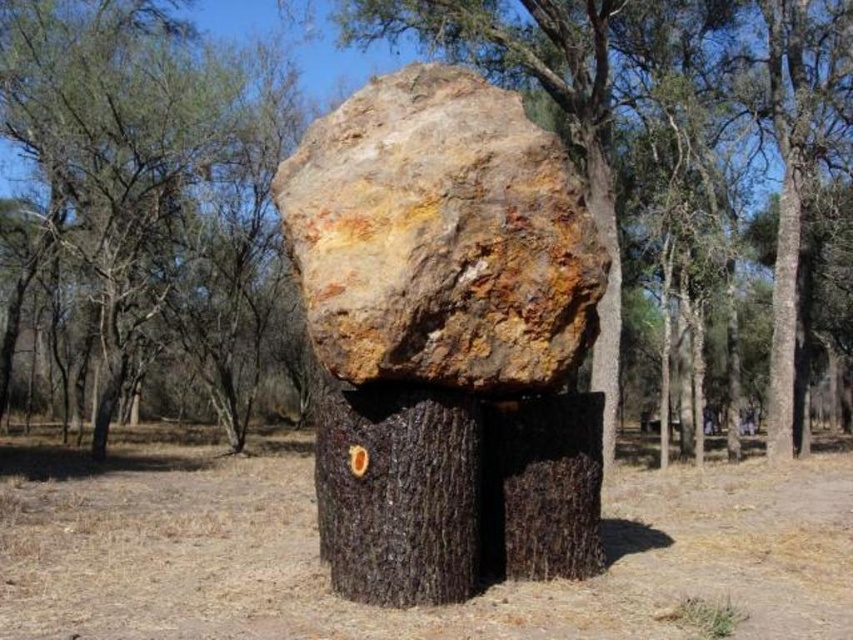
Question: Among these objects, which one is nearest to the camera?

Choices:
 (A) brown rough bark at center
 (B) rusty stone boulder at center
 (C) brown rough tree trunk at right
 (D) brown rough tree trunk at center

Answer: (B)

Question: Does brown rough bark at center come behind rusty stone boulder at center?

Choices:
 (A) yes
 (B) no

Answer: (A)

Question: Does brown rough bark at center have a greater width compared to brown rough tree trunk at right?

Choices:
 (A) yes
 (B) no

Answer: (A)

Question: Which of the following is the farthest from the observer?

Choices:
 (A) rusty stone boulder at center
 (B) brown rough tree trunk at center
 (C) brown rough tree trunk at right

Answer: (C)

Question: Is brown rough bark at center to the left of rusty stone boulder at center from the viewer's perspective?

Choices:
 (A) yes
 (B) no

Answer: (A)

Question: Among these objects, which one is farthest from the camera?

Choices:
 (A) brown rough bark at center
 (B) rusty stone boulder at center

Answer: (A)